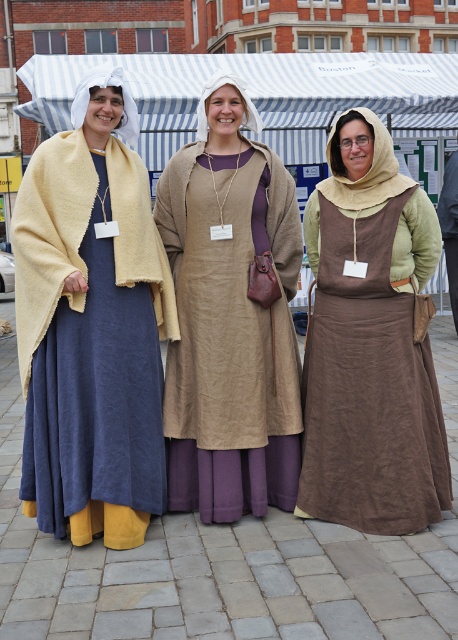
Is matte yellow shawl at left wider than brown linen apron at center?

Yes, matte yellow shawl at left is wider than brown linen apron at center.

Which is in front, point (28, 445) or point (343, 144)?

Positioned in front is point (28, 445).

Locate an element on the screen. matte yellow shawl at left is located at coordinates (92, 324).

Who is positioned more to the left, matte beige tunic at center or brown linen apron at center?

From the viewer's perspective, matte beige tunic at center appears more on the left side.

What do you see at coordinates (230, 316) in the screenshot?
I see `matte beige tunic at center` at bounding box center [230, 316].

Identify the location of matte beige tunic at center. The height and width of the screenshot is (640, 458). (230, 316).

Which of these two, matte yellow shawl at left or matte beige tunic at center, stands shorter?

With less height is matte beige tunic at center.

Can you confirm if matte yellow shawl at left is positioned to the left of matte beige tunic at center?

Indeed, matte yellow shawl at left is positioned on the left side of matte beige tunic at center.

Between point (114, 522) and point (189, 500), which one is positioned behind?

The point (189, 500) is behind.

I want to click on matte yellow shawl at left, so click(92, 324).